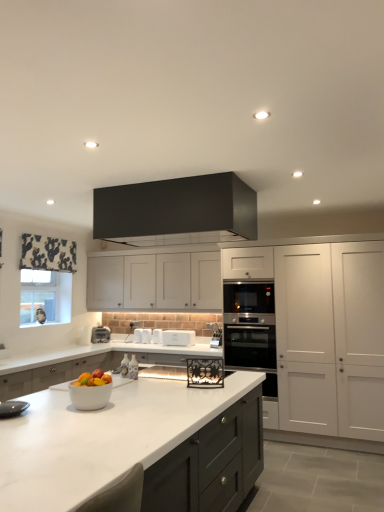
Question: Is white matte cabinet at center, which ranks as the 3th cabinetry in front-to-back order, beside white marble countertop at center?

Choices:
 (A) no
 (B) yes

Answer: (A)

Question: Is white matte cabinet at center, the first cabinetry in the back-to-front sequence, thinner than white marble countertop at center?

Choices:
 (A) yes
 (B) no

Answer: (A)

Question: Could white marble countertop at center be considered to be inside white matte cabinet at center, which ranks as the 3th cabinetry in front-to-back order?

Choices:
 (A) no
 (B) yes

Answer: (A)

Question: From the image's perspective, is white matte cabinet at center, which ranks as the 3th cabinetry in front-to-back order, under white marble countertop at center?

Choices:
 (A) yes
 (B) no

Answer: (B)

Question: Could you tell me if white matte cabinet at center, the first cabinetry in the back-to-front sequence, is facing white marble countertop at center?

Choices:
 (A) yes
 (B) no

Answer: (B)

Question: Considering the relative sizes of white matte cabinet at center, the first cabinetry in the back-to-front sequence, and white marble countertop at center in the image provided, is white matte cabinet at center, the first cabinetry in the back-to-front sequence, smaller than white marble countertop at center?

Choices:
 (A) yes
 (B) no

Answer: (A)

Question: Considering the relative positions of satin silver oven at center, the 1th oven positioned from the bottom, and white plastic toaster at center, the 3th appliance when ordered from left to right, in the image provided, is satin silver oven at center, the 1th oven positioned from the bottom, to the left of white plastic toaster at center, the 3th appliance when ordered from left to right, from the viewer's perspective?

Choices:
 (A) yes
 (B) no

Answer: (B)

Question: Is satin silver oven at center, the 1th oven positioned from the bottom, taller than white plastic toaster at center, acting as the 2th appliance starting from the right?

Choices:
 (A) no
 (B) yes

Answer: (B)

Question: Is satin silver oven at center, which appears as the second oven when viewed from the top, facing away from white plastic toaster at center, acting as the 2th appliance starting from the right?

Choices:
 (A) no
 (B) yes

Answer: (A)

Question: Is satin silver oven at center, the 1th oven positioned from the bottom, far away from white plastic toaster at center, acting as the 2th appliance starting from the right?

Choices:
 (A) no
 (B) yes

Answer: (B)

Question: Is satin silver oven at center, the 1th oven positioned from the bottom, further to the viewer compared to white plastic toaster at center, the 3th appliance when ordered from left to right?

Choices:
 (A) yes
 (B) no

Answer: (B)

Question: Would you say satin silver oven at center, which appears as the second oven when viewed from the top, is outside white plastic toaster at center, the 3th appliance when ordered from left to right?

Choices:
 (A) yes
 (B) no

Answer: (A)

Question: From a real-world perspective, is satin black oven at right, which is the 1th oven from top to bottom, located higher than white marble countertop at center?

Choices:
 (A) yes
 (B) no

Answer: (A)